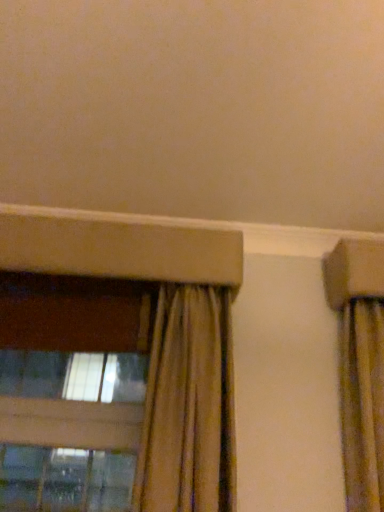
What do you see at coordinates (189, 406) in the screenshot? I see `beige fabric curtain at center` at bounding box center [189, 406].

I want to click on beige fabric curtain at center, so click(189, 406).

This screenshot has height=512, width=384. Identify the location of beige fabric curtain at center. (189, 406).